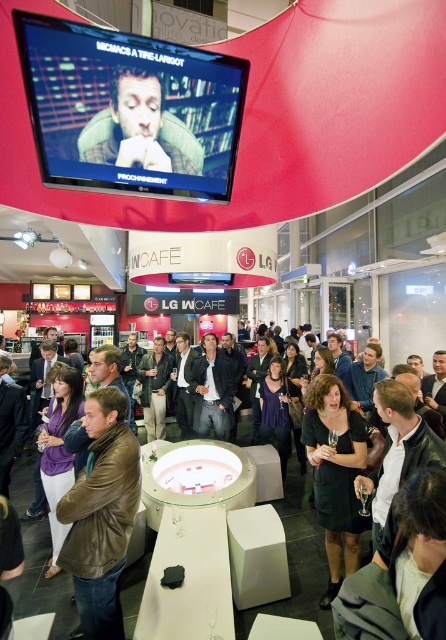
Based on the photo, you are standing at the entrance of the venue and want to reach the large screen. There are two points marked as point 1 at coordinates (106,456) and point 2 at coordinates (111,108). Which point should you avoid stepping on if you want to move directly towards the large screen?

You should avoid stepping on point 1 at coordinates (106,456) because it is behind point 2 at coordinates (111,108), meaning it is further away from the entrance and not on the direct path towards the large screen.

Consider the image. You are a photographer positioned at the back of the room. You want to take a photo of the black satin dress at center without the brown leather jacket at lower left blocking it. What should you do?

The brown leather jacket at lower left is in front of the black satin dress at center, so to avoid blocking, move to a position where the jacket is no longer between you and the dress.

You are standing at the entrance of the venue and want to walk towards the two points marked in the scene. Which point, point (330, 570) or point (119, 120), will you reach first?

You will reach point (119, 120) first because it is closer to you than point (330, 570), which is further away.